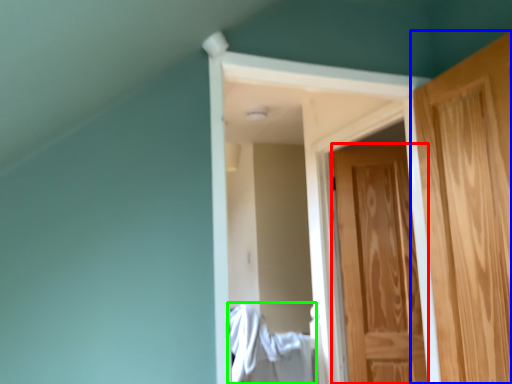
Question: Considering the real-world distances, which object is closest to door (highlighted by a red box)? door (highlighted by a blue box) or laundry (highlighted by a green box).

Choices:
 (A) door
 (B) laundry

Answer: (B)